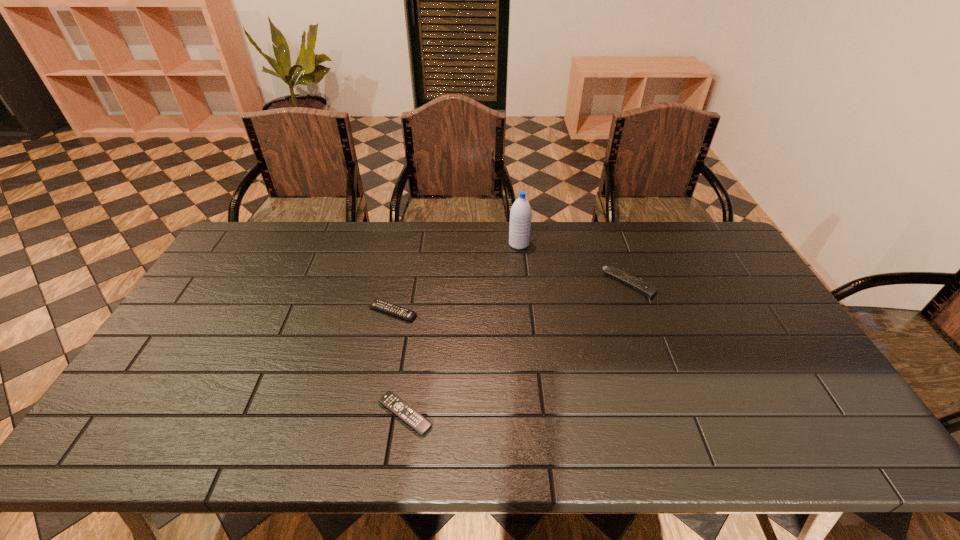
Locate an element on the screen. The width and height of the screenshot is (960, 540). free space between the nearest remote control and the farthest object is located at coordinates (462, 329).

Locate an element on the screen. The height and width of the screenshot is (540, 960). empty space between the tallest object and the rightmost remote control is located at coordinates (574, 264).

What are the coordinates of `empty space that is in between the second farthest remote control and the nearest remote control` in the screenshot? It's located at [x=399, y=363].

Image resolution: width=960 pixels, height=540 pixels. Identify the location of empty space that is in between the tallest remote control and the nearest remote control. (517, 349).

Image resolution: width=960 pixels, height=540 pixels. Find the location of `unoccupied position between the farthest object and the nearest object`. unoccupied position between the farthest object and the nearest object is located at coordinates (462, 329).

Locate an element on the screen. This screenshot has height=540, width=960. vacant region between the third nearest object and the second farthest remote control is located at coordinates (511, 298).

You are a GUI agent. You are given a task and a screenshot of the screen. Output one action in this format:
    pyautogui.click(x=<x>, y=<y>)
    Task: Click on the vacant point located between the second object from right to left and the rightmost remote control
    
    Given the screenshot: What is the action you would take?
    pyautogui.click(x=574, y=264)

Find the location of a particular element. The width and height of the screenshot is (960, 540). the second closest object to the third farthest object is located at coordinates (521, 213).

You are a GUI agent. You are given a task and a screenshot of the screen. Output one action in this format:
    pyautogui.click(x=<x>, y=<y>)
    Task: Click on the object that stands as the closest to the second farthest remote control
    
    Given the screenshot: What is the action you would take?
    pyautogui.click(x=393, y=403)

Where is `remote control that can be found as the second closest to the rightmost remote control`? remote control that can be found as the second closest to the rightmost remote control is located at coordinates (393, 403).